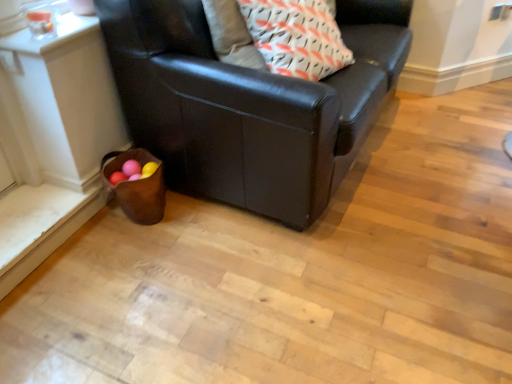
Question: Is white with orange and black patterned pillow at upper center positioned beyond the bounds of black leather couch at lower left?

Choices:
 (A) no
 (B) yes

Answer: (A)

Question: From a real-world perspective, is white with orange and black patterned pillow at upper center below black leather couch at lower left?

Choices:
 (A) no
 (B) yes

Answer: (A)

Question: From a real-world perspective, is white with orange and black patterned pillow at upper center on top of black leather couch at lower left?

Choices:
 (A) no
 (B) yes

Answer: (B)

Question: Can you confirm if white with orange and black patterned pillow at upper center is bigger than black leather couch at lower left?

Choices:
 (A) no
 (B) yes

Answer: (A)

Question: Considering the relative sizes of white with orange and black patterned pillow at upper center and black leather couch at lower left in the image provided, is white with orange and black patterned pillow at upper center thinner than black leather couch at lower left?

Choices:
 (A) no
 (B) yes

Answer: (B)

Question: Can you confirm if white with orange and black patterned pillow at upper center is smaller than black leather couch at lower left?

Choices:
 (A) yes
 (B) no

Answer: (A)

Question: Does black leather couch at lower left have a greater height compared to white with orange and black patterned pillow at upper center?

Choices:
 (A) yes
 (B) no

Answer: (A)

Question: Is black leather couch at lower left not inside white with orange and black patterned pillow at upper center?

Choices:
 (A) no
 (B) yes

Answer: (B)

Question: Can you confirm if black leather couch at lower left is thinner than white with orange and black patterned pillow at upper center?

Choices:
 (A) yes
 (B) no

Answer: (B)

Question: Can you confirm if black leather couch at lower left is positioned to the right of white with orange and black patterned pillow at upper center?

Choices:
 (A) yes
 (B) no

Answer: (B)

Question: Is black leather couch at lower left to the left of white with orange and black patterned pillow at upper center from the viewer's perspective?

Choices:
 (A) yes
 (B) no

Answer: (A)

Question: Can you confirm if black leather couch at lower left is shorter than white with orange and black patterned pillow at upper center?

Choices:
 (A) yes
 (B) no

Answer: (B)

Question: Considering the positions of black leather couch at lower left and white with orange and black patterned pillow at upper center in the image, is black leather couch at lower left taller or shorter than white with orange and black patterned pillow at upper center?

Choices:
 (A) tall
 (B) short

Answer: (A)